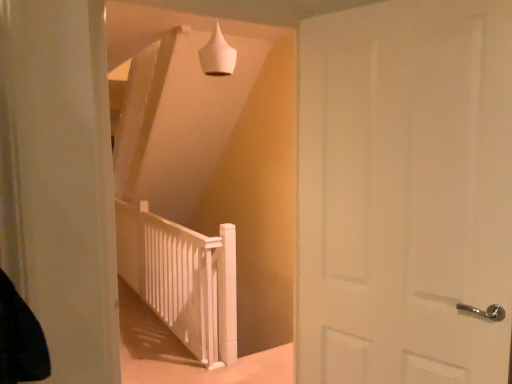
Question: Is white matte door at center at the right side of white matte rail at center?

Choices:
 (A) no
 (B) yes

Answer: (B)

Question: Does white matte door at center have a lesser height compared to white matte rail at center?

Choices:
 (A) no
 (B) yes

Answer: (A)

Question: Is white matte door at center facing towards white matte rail at center?

Choices:
 (A) yes
 (B) no

Answer: (B)

Question: Is white matte rail at center at the back of white matte door at center?

Choices:
 (A) yes
 (B) no

Answer: (B)

Question: From a real-world perspective, is white matte door at center positioned under white matte rail at center based on gravity?

Choices:
 (A) no
 (B) yes

Answer: (A)

Question: Considering the relative positions of white matte door at center and white matte rail at center in the image provided, is white matte door at center behind white matte rail at center?

Choices:
 (A) no
 (B) yes

Answer: (A)

Question: From the image's perspective, does white matte rail at center appear higher than white matte cone at upper center?

Choices:
 (A) yes
 (B) no

Answer: (B)

Question: Is white matte rail at center oriented away from white matte cone at upper center?

Choices:
 (A) yes
 (B) no

Answer: (B)

Question: Is white matte rail at center shorter than white matte cone at upper center?

Choices:
 (A) yes
 (B) no

Answer: (B)

Question: Can you confirm if white matte rail at center is taller than white matte cone at upper center?

Choices:
 (A) no
 (B) yes

Answer: (B)

Question: From a real-world perspective, is white matte rail at center physically below white matte cone at upper center?

Choices:
 (A) no
 (B) yes

Answer: (B)

Question: Does white matte rail at center have a smaller size compared to white matte cone at upper center?

Choices:
 (A) no
 (B) yes

Answer: (A)

Question: Can you confirm if white matte door at center is bigger than white matte cone at upper center?

Choices:
 (A) no
 (B) yes

Answer: (B)